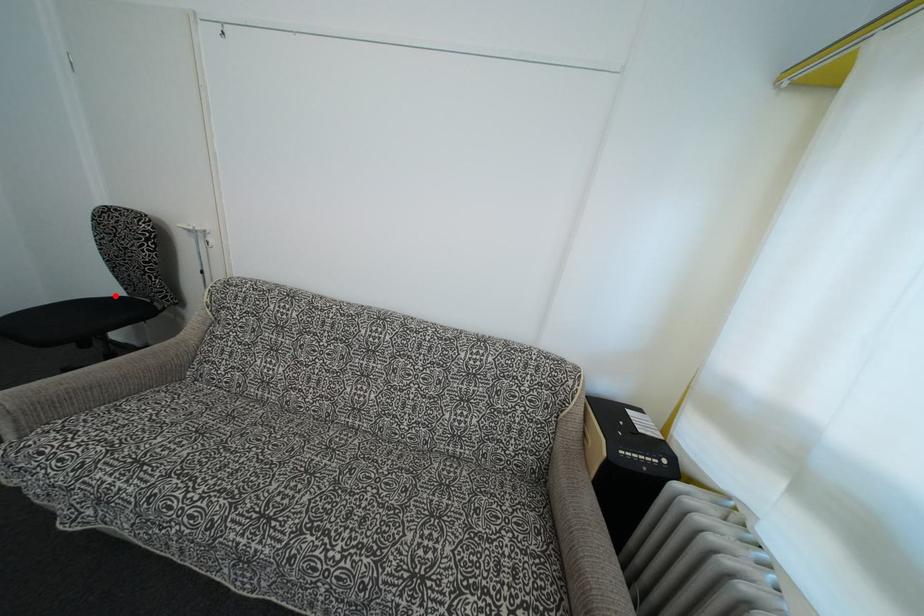
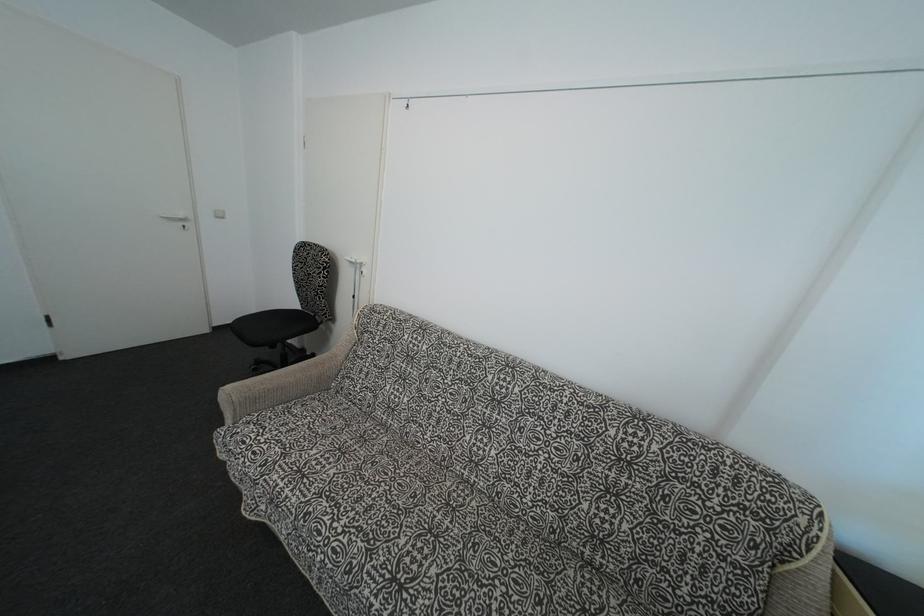
In the second image, find the point that corresponds to the highlighted location in the first image.

(297, 310)